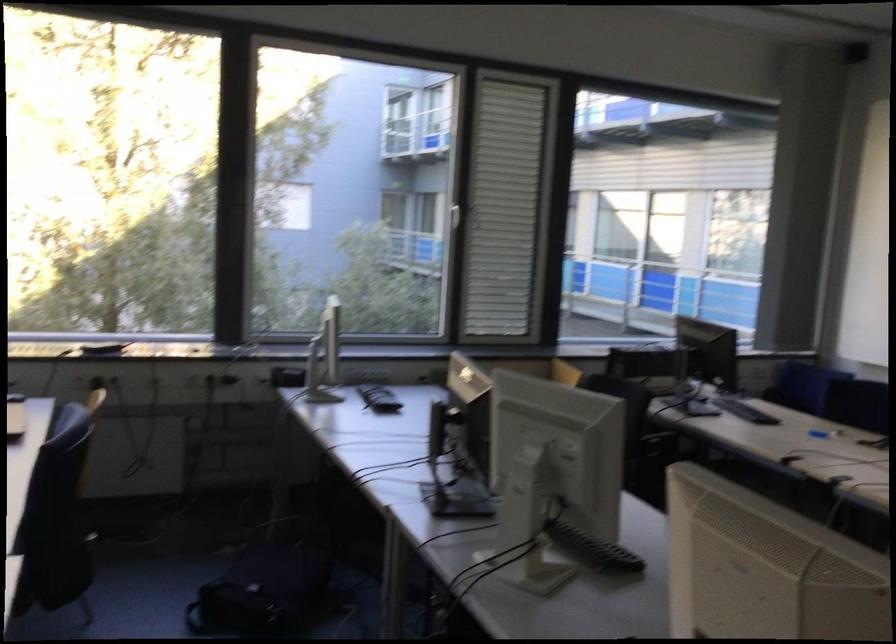
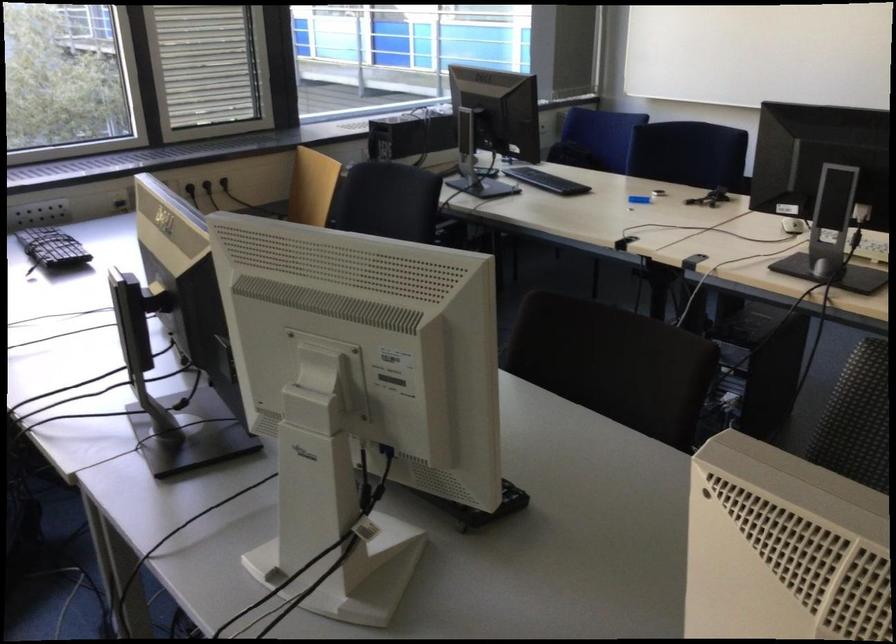
Locate, in the second image, the point that corresponds to the point at 554,377 in the first image.

(312, 187)